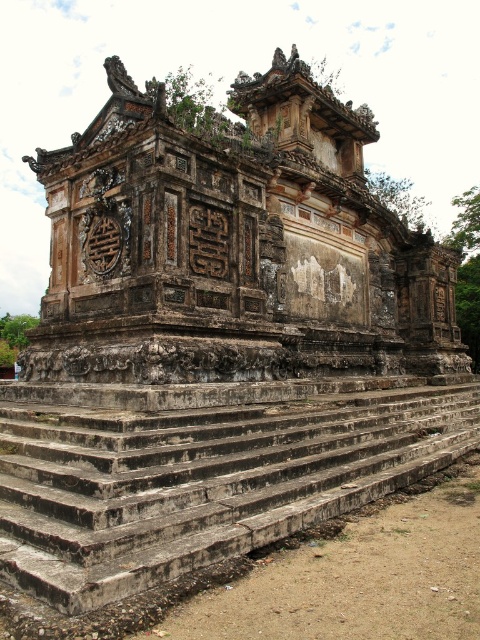
Does weathered stone structure at center have a greater height compared to weathered stone stairs at center?

Yes, weathered stone structure at center is taller than weathered stone stairs at center.

Is weathered stone structure at center in front of weathered stone stairs at center?

No, it is not.

Does point (101, 179) come in front of point (164, 570)?

That is False.

Identify the location of weathered stone structure at center. The width and height of the screenshot is (480, 640). (233, 246).